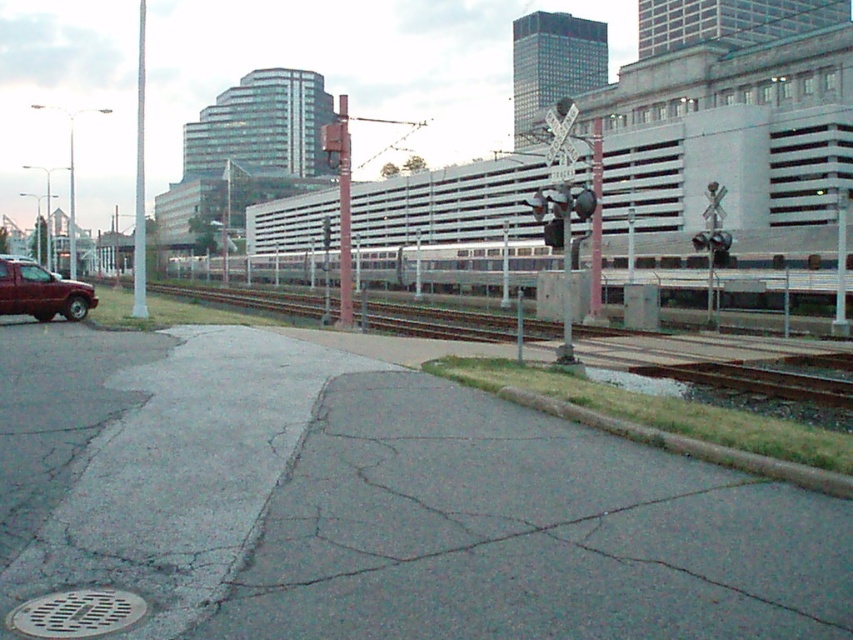
In the scene shown: You are a delivery driver approaching the railway crossing. You see a metallic gray pole at center and a white glossy pole at center. How far apart are these two poles?

The distance between the metallic gray pole at center and the white glossy pole at center is 110.66 feet.

You are a pedestrian standing at the railway crossing and want to reach the white glossy pole at center. Which direction should you walk to avoid the metallic gray pole at center?

You should walk to the right of the metallic gray pole at center to reach the white glossy pole at center, as the metallic gray pole is closer to you and blocking the path directly ahead.

You are a pedestrian standing at the railway crossing and want to cross to the other side. There is a matte red truck at left and a white glossy pole at center. Which object is closer to you as you face the crossing?

The matte red truck at left is closer to you because it is in front of the white glossy pole at center.